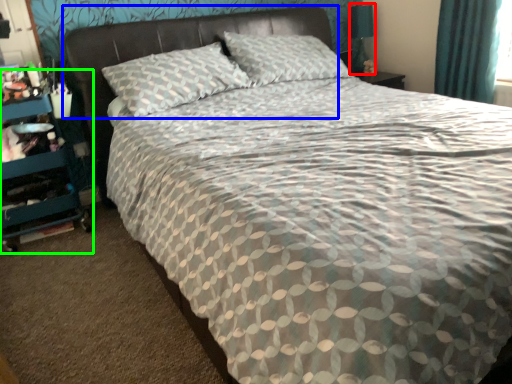
Question: Which object is positioned farthest from table lamp (highlighted by a red box)? Select from headboard (highlighted by a blue box) and dresser (highlighted by a green box).

Choices:
 (A) headboard
 (B) dresser

Answer: (B)